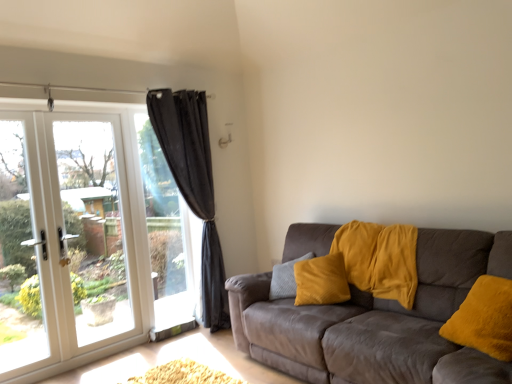
Measure the distance between point (175, 224) and camera.

The depth of point (175, 224) is 13.80 feet.

This screenshot has width=512, height=384. In order to click on velvet brown couch at right in this screenshot , I will do `click(378, 321)`.

Find the location of a particular element. This screenshot has height=384, width=512. white glass door at left is located at coordinates (66, 243).

Is velvet brown couch at right far away from black sheer curtain at left?

That's right, there is a large distance between velvet brown couch at right and black sheer curtain at left.

Considering the sizes of objects velvet brown couch at right and black sheer curtain at left in the image provided, who is wider, velvet brown couch at right or black sheer curtain at left?

velvet brown couch at right is wider.

Is velvet brown couch at right taller than black sheer curtain at left?

In fact, velvet brown couch at right may be shorter than black sheer curtain at left.

Can you tell me how much velvet brown couch at right and black sheer curtain at left differ in facing direction?

The angle between the facing direction of velvet brown couch at right and the facing direction of black sheer curtain at left is 179 degrees.

Considering the sizes of black curtain at left and velvet brown couch at right in the image, is black curtain at left bigger or smaller than velvet brown couch at right?

In the image, black curtain at left appears to be smaller than velvet brown couch at right.

Which is more to the right, black curtain at left or velvet brown couch at right?

velvet brown couch at right.

Would you say black curtain at left is outside velvet brown couch at right?

black curtain at left is positioned outside velvet brown couch at right.

In the scene shown: From a real-world perspective, between black curtain at left and velvet brown couch at right, who is vertically lower?

velvet brown couch at right.

Does black sheer curtain at left lie in front of black curtain at left?

Yes, black sheer curtain at left is closer to the viewer.

Which of these two, black sheer curtain at left or black curtain at left, stands shorter?

black curtain at left.

How many degrees apart are the facing directions of black sheer curtain at left and black curtain at left?

The angle between the facing direction of black sheer curtain at left and the facing direction of black curtain at left is 0.0878 degrees.

Is black sheer curtain at left wider than black curtain at left?

Yes.

Is white glass door at left spatially inside black sheer curtain at left, or outside of it?

white glass door at left is outside black sheer curtain at left.

Based on their sizes in the image, would you say white glass door at left is bigger or smaller than black sheer curtain at left?

Clearly, white glass door at left is smaller in size than black sheer curtain at left.

Is white glass door at left positioned far away from black sheer curtain at left?

That's not correct — white glass door at left is a little close to black sheer curtain at left.

From the image's perspective, is white glass door at left above black sheer curtain at left?

Incorrect, from the image's perspective, white glass door at left is lower than black sheer curtain at left.

How many degrees apart are the facing directions of black sheer curtain at left and velvet brown couch at right?

179 degrees separate the facing orientations of black sheer curtain at left and velvet brown couch at right.

Is the position of black sheer curtain at left more distant than that of velvet brown couch at right?

That is True.

Does point (200, 158) appear closer or farther from the camera than point (448, 303)?

Point (200, 158) appears to be farther away from the viewer than point (448, 303).

Is there a large distance between black sheer curtain at left and velvet brown couch at right?

black sheer curtain at left is far away from velvet brown couch at right.

From a real-world perspective, who is located higher, black sheer curtain at left or white glass door at left?

black sheer curtain at left is physically above.

Considering the positions of points (157, 91) and (64, 355), is point (157, 91) closer to camera compared to point (64, 355)?

No, (157, 91) is behind (64, 355).

Is black sheer curtain at left closer to the viewer compared to white glass door at left?

No.

From the image's perspective, is black sheer curtain at left above or below white glass door at left?

Clearly, from the image's perspective, black sheer curtain at left is above white glass door at left.

Is white glass door at left wider than velvet brown couch at right?

No, white glass door at left is not wider than velvet brown couch at right.

Is velvet brown couch at right a part of white glass door at left?

Actually, velvet brown couch at right is outside white glass door at left.

Is white glass door at left placed right next to velvet brown couch at right?

No, white glass door at left is not in contact with velvet brown couch at right.

Locate an element on the screen. The image size is (512, 384). curtain behind the velvet brown couch at right is located at coordinates (193, 185).

At what (x,y) coordinates should I click in order to perform the action: click on studio couch below the black curtain at left (from the image's perspective). Please return your answer as a coordinate pair (x, y). The image size is (512, 384). Looking at the image, I should click on (378, 321).

Considering their positions, is black curtain at left positioned further to white glass door at left than black sheer curtain at left?

Based on the image, black sheer curtain at left appears to be further to white glass door at left.

Looking at the image, which one is located further to black sheer curtain at left, black curtain at left or white glass door at left?

white glass door at left is further to black sheer curtain at left.

Looking at the image, which one is located closer to velvet brown couch at right, black curtain at left or black sheer curtain at left?

Among the two, black sheer curtain at left is located nearer to velvet brown couch at right.

Considering their positions, is black sheer curtain at left positioned further to black curtain at left than velvet brown couch at right?

velvet brown couch at right is further to black curtain at left.

When comparing their distances from velvet brown couch at right, does white glass door at left or black curtain at left seem further?

The object further to velvet brown couch at right is white glass door at left.

Estimate the real-world distances between objects in this image. Which object is closer to white glass door at left, black sheer curtain at left or black curtain at left?

black curtain at left lies closer to white glass door at left than the other object.

Estimate the real-world distances between objects in this image. Which object is closer to white glass door at left, black curtain at left or velvet brown couch at right?

black curtain at left lies closer to white glass door at left than the other object.

Estimate the real-world distances between objects in this image. Which object is closer to velvet brown couch at right, black curtain at left or white glass door at left?

Based on the image, black curtain at left appears to be nearer to velvet brown couch at right.

Where is `door located between velvet brown couch at right and black sheer curtain at left in the depth direction`? door located between velvet brown couch at right and black sheer curtain at left in the depth direction is located at coordinates tap(66, 243).

Locate an element on the screen. curtain located between velvet brown couch at right and black curtain at left in the depth direction is located at coordinates (193, 185).

Where is `door located between velvet brown couch at right and black curtain at left in the depth direction`? door located between velvet brown couch at right and black curtain at left in the depth direction is located at coordinates (66, 243).

Where is `curtain positioned between white glass door at left and black curtain at left from near to far`? The width and height of the screenshot is (512, 384). curtain positioned between white glass door at left and black curtain at left from near to far is located at coordinates (193, 185).